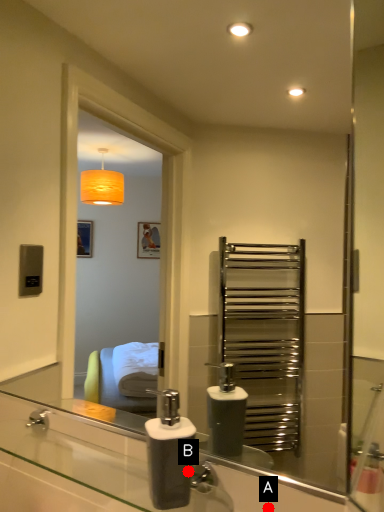
Question: Two points are circled on the image, labeled by A and B beside each circle. Which of the following is the farthest from the observer?

Choices:
 (A) A is further
 (B) B is further

Answer: (A)